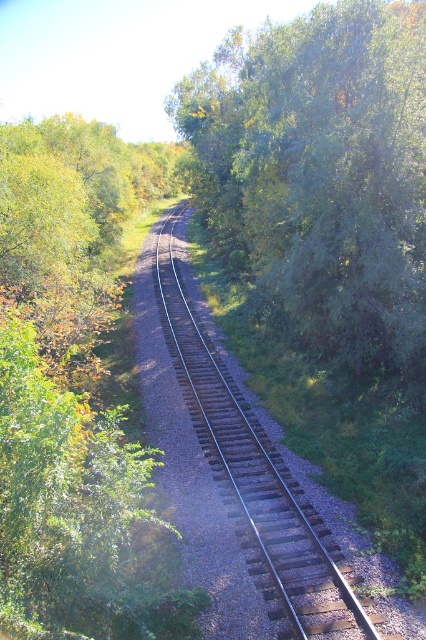
Question: Does green leafy tree at center have a greater width compared to brown gravel track at center?

Choices:
 (A) no
 (B) yes

Answer: (B)

Question: Is green leafy tree at center bigger than brown gravel track at center?

Choices:
 (A) yes
 (B) no

Answer: (A)

Question: Which object appears closest to the camera in this image?

Choices:
 (A) brown gravel track at center
 (B) green leafy tree at center

Answer: (A)

Question: Can you confirm if green leafy tree at center is positioned to the right of brown gravel track at center?

Choices:
 (A) yes
 (B) no

Answer: (A)

Question: Which of the following is the closest to the observer?

Choices:
 (A) (184, 349)
 (B) (348, 20)

Answer: (B)